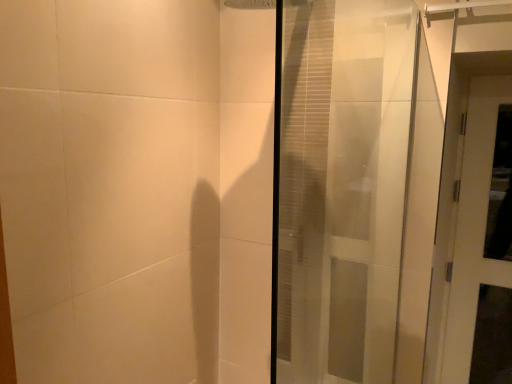
Describe the element at coordinates (473, 226) in the screenshot. I see `white glossy door at right, the 1th door in the back-to-front sequence` at that location.

Locate an element on the screen. This screenshot has height=384, width=512. white glossy door at right, the 1th door in the back-to-front sequence is located at coordinates point(473,226).

What is the approximate width of transparent glass door at center, the first door positioned from the front?

It is 5.12 centimeters.

Describe the element at coordinates (340, 186) in the screenshot. This screenshot has height=384, width=512. I see `transparent glass door at center, the second door when ordered from back to front` at that location.

Identify the location of transparent glass door at center, the first door positioned from the front. The width and height of the screenshot is (512, 384). (340, 186).

I want to click on white glossy door at right, which ranks as the first door in right-to-left order, so click(473, 226).

Is transparent glass door at center, the second door when ordered from back to front, to the left of white glossy door at right, the 1th door in the back-to-front sequence, from the viewer's perspective?

Correct, you'll find transparent glass door at center, the second door when ordered from back to front, to the left of white glossy door at right, the 1th door in the back-to-front sequence.

Which object is closer to the camera taking this photo, transparent glass door at center, the second door when ordered from back to front, or white glossy door at right, which ranks as the first door in right-to-left order?

transparent glass door at center, the second door when ordered from back to front, is more forward.

Which is in front, point (293, 286) or point (464, 330)?

The point (293, 286) is closer to the camera.

From the image's perspective, which one is positioned higher, transparent glass door at center, the second door when ordered from back to front, or white glossy door at right, which appears as the second door when viewed from the front?

transparent glass door at center, the second door when ordered from back to front, is shown above in the image.

From a real-world perspective, is transparent glass door at center, the second door in the right-to-left sequence, over white glossy door at right, which ranks as the first door in right-to-left order?

Yes, from a real-world perspective, transparent glass door at center, the second door in the right-to-left sequence, is over white glossy door at right, which ranks as the first door in right-to-left order

Which of these two, transparent glass door at center, the second door when ordered from back to front, or white glossy door at right, the 1th door in the back-to-front sequence, is wider?

transparent glass door at center, the second door when ordered from back to front.

Considering the relative sizes of transparent glass door at center, positioned as the 1th door in left-to-right order, and white glossy door at right, the 1th door in the back-to-front sequence, in the image provided, is transparent glass door at center, positioned as the 1th door in left-to-right order, shorter than white glossy door at right, the 1th door in the back-to-front sequence,?

Correct, transparent glass door at center, positioned as the 1th door in left-to-right order, is not as tall as white glossy door at right, the 1th door in the back-to-front sequence.

Considering the relative sizes of transparent glass door at center, positioned as the 1th door in left-to-right order, and white glossy door at right, the 1th door in the back-to-front sequence, in the image provided, is transparent glass door at center, positioned as the 1th door in left-to-right order, smaller than white glossy door at right, the 1th door in the back-to-front sequence,?

No.

Can white glossy door at right, which appears as the second door when viewed from the front, be found inside transparent glass door at center, the second door in the right-to-left sequence?

No.

Is there a large distance between transparent glass door at center, positioned as the 1th door in left-to-right order, and white glossy door at right, which appears as the second door when viewed from the front?

No, there isn't a large distance between transparent glass door at center, positioned as the 1th door in left-to-right order, and white glossy door at right, which appears as the second door when viewed from the front.

Is transparent glass door at center, the second door when ordered from back to front, positioned with its back to white glossy door at right, the 1th door in the back-to-front sequence?

No, transparent glass door at center, the second door when ordered from back to front, is not facing away from white glossy door at right, the 1th door in the back-to-front sequence.

How many degrees apart are the facing directions of transparent glass door at center, the first door positioned from the front, and white glossy door at right, the 1th door in the back-to-front sequence?

The angle between the facing direction of transparent glass door at center, the first door positioned from the front, and the facing direction of white glossy door at right, the 1th door in the back-to-front sequence, is 89.4 degrees.

Locate an element on the screen. The image size is (512, 384). door that is on the right side of transparent glass door at center, positioned as the 1th door in left-to-right order is located at coordinates (473, 226).

Is white glossy door at right, the 2th door in the left-to-right sequence, to the right of transparent glass door at center, positioned as the 1th door in left-to-right order, from the viewer's perspective?

Correct, you'll find white glossy door at right, the 2th door in the left-to-right sequence, to the right of transparent glass door at center, positioned as the 1th door in left-to-right order.

Based on the photo, which object is further away from the camera, white glossy door at right, which appears as the second door when viewed from the front, or transparent glass door at center, the second door in the right-to-left sequence?

white glossy door at right, which appears as the second door when viewed from the front, is behind.

Is point (462, 222) behind point (304, 14)?

Yes, it is behind point (304, 14).

From the image's perspective, does white glossy door at right, which appears as the second door when viewed from the front, appear higher than transparent glass door at center, positioned as the 1th door in left-to-right order?

No.

From a real-world perspective, which is physically above, white glossy door at right, which ranks as the first door in right-to-left order, or transparent glass door at center, the first door positioned from the front?

From a 3D spatial view, transparent glass door at center, the first door positioned from the front, is above.

Between white glossy door at right, the 1th door in the back-to-front sequence, and transparent glass door at center, the second door when ordered from back to front, which one has smaller width?

Thinner between the two is white glossy door at right, the 1th door in the back-to-front sequence.

Consider the image. Can you confirm if white glossy door at right, which ranks as the first door in right-to-left order, is shorter than transparent glass door at center, the second door when ordered from back to front?

No, white glossy door at right, which ranks as the first door in right-to-left order, is not shorter than transparent glass door at center, the second door when ordered from back to front.

Between white glossy door at right, which appears as the second door when viewed from the front, and transparent glass door at center, the second door when ordered from back to front, which one has smaller size?

Smaller between the two is white glossy door at right, which appears as the second door when viewed from the front.

Is transparent glass door at center, positioned as the 1th door in left-to-right order, a part of white glossy door at right, the 1th door in the back-to-front sequence?

No, transparent glass door at center, positioned as the 1th door in left-to-right order, is not inside white glossy door at right, the 1th door in the back-to-front sequence.

Is there a large distance between white glossy door at right, the 1th door in the back-to-front sequence, and transparent glass door at center, positioned as the 1th door in left-to-right order?

white glossy door at right, the 1th door in the back-to-front sequence, is actually quite close to transparent glass door at center, positioned as the 1th door in left-to-right order.

Is white glossy door at right, which appears as the second door when viewed from the front, facing towards transparent glass door at center, positioned as the 1th door in left-to-right order?

No, white glossy door at right, which appears as the second door when viewed from the front, is not oriented towards transparent glass door at center, positioned as the 1th door in left-to-right order.

Where is `door in front of the white glossy door at right, which ranks as the first door in right-to-left order`? This screenshot has width=512, height=384. door in front of the white glossy door at right, which ranks as the first door in right-to-left order is located at coordinates (340, 186).

You are a GUI agent. You are given a task and a screenshot of the screen. Output one action in this format:
    pyautogui.click(x=<x>, y=<y>)
    Task: Click on the door lying on the left of white glossy door at right, the 1th door in the back-to-front sequence
    
    Given the screenshot: What is the action you would take?
    pyautogui.click(x=340, y=186)

Find the location of a particular element. door behind the transparent glass door at center, the second door when ordered from back to front is located at coordinates (473, 226).